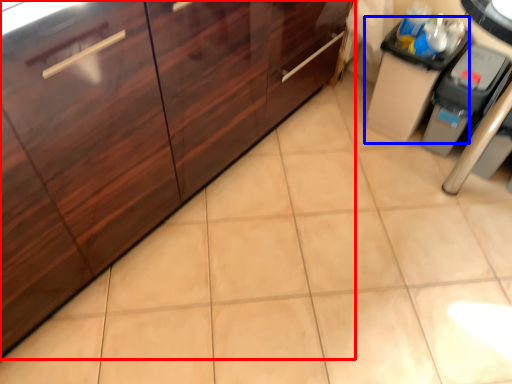
Question: Which object is closer to the camera taking this photo, cabinetry (highlighted by a red box) or cabinetry (highlighted by a blue box)?

Choices:
 (A) cabinetry
 (B) cabinetry

Answer: (A)